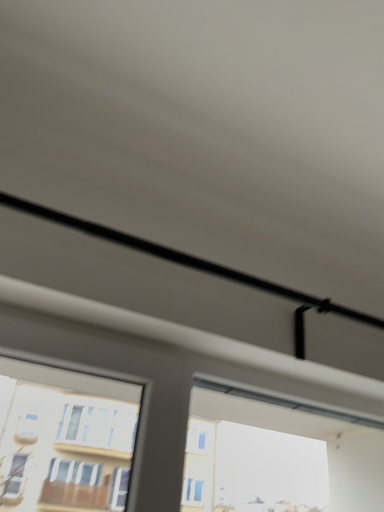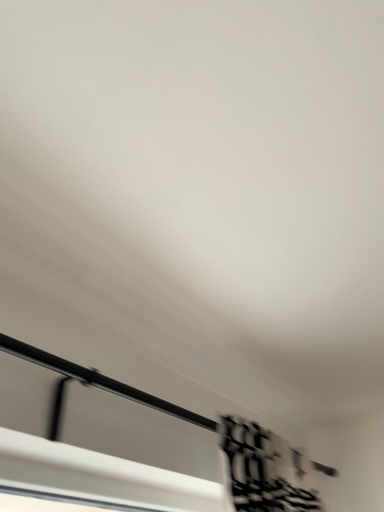
Question: Which way did the camera rotate in the video?

Choices:
 (A) rotated left
 (B) rotated right

Answer: (B)